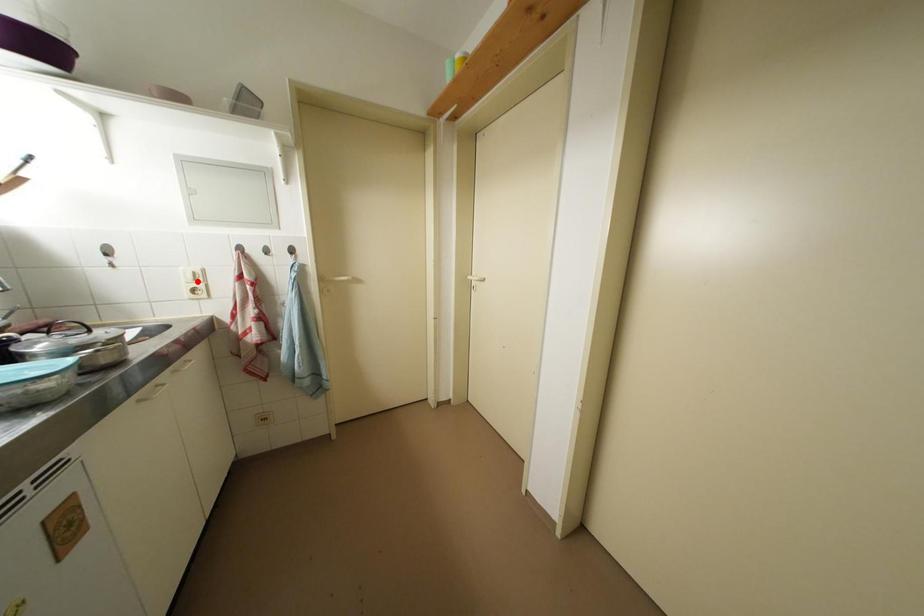
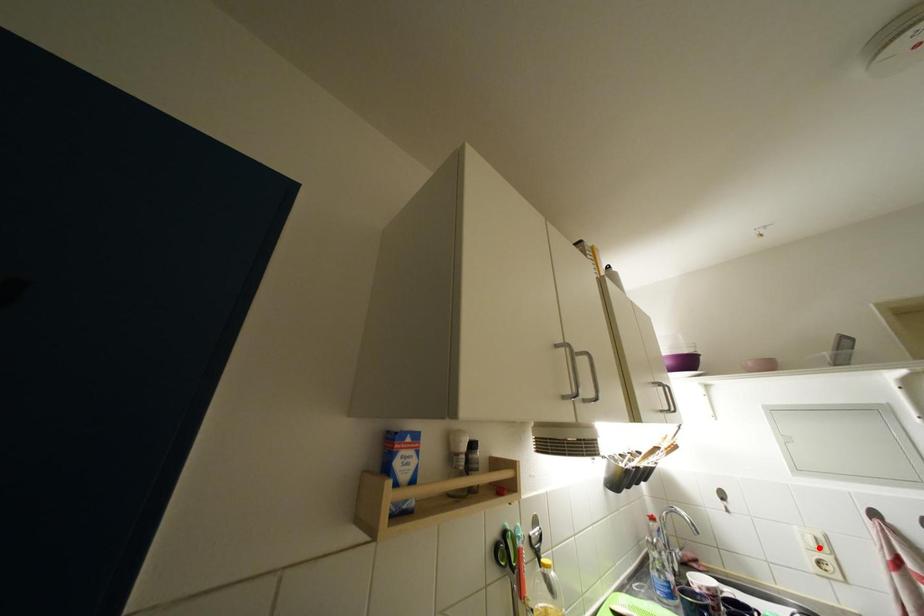
I am providing you with two images of the same scene from different viewpoints. A red point is marked on the first image and another point is marked on the second image. Do the highlighted points in image1 and image2 indicate the same real-world spot?

Yes